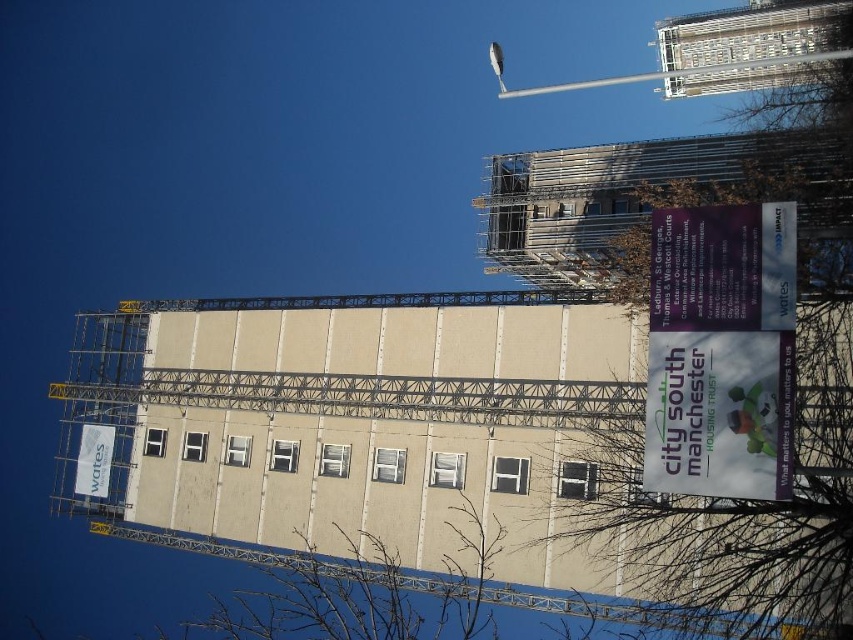
Is beige concrete building at upper right further to camera compared to white paper sign at upper left?

No.

Is beige concrete building at upper right above white paper sign at upper left?

Correct, beige concrete building at upper right is located above white paper sign at upper left.

Is point (793, 76) positioned behind point (80, 474)?

That is True.

You are a GUI agent. You are given a task and a screenshot of the screen. Output one action in this format:
    pyautogui.click(x=<x>, y=<y>)
    Task: Click on the beige concrete building at upper right
    The width and height of the screenshot is (853, 640).
    Given the screenshot: What is the action you would take?
    pyautogui.click(x=741, y=45)

Can you confirm if beige concrete building at upper right is bigger than metallic pole at upper center?

No, beige concrete building at upper right is not bigger than metallic pole at upper center.

Find the location of a particular element. This screenshot has height=640, width=853. beige concrete building at upper right is located at coordinates (741, 45).

Is point (677, 35) more distant than point (503, 97)?

Yes, it is.

This screenshot has height=640, width=853. I want to click on beige concrete building at upper right, so click(741, 45).

Is purple paper sign at upper right wider than metallic pole at upper center?

No.

Find the location of a particular element. This screenshot has width=853, height=640. purple paper sign at upper right is located at coordinates (721, 352).

Measure the distance between purple paper sign at upper right and camera.

A distance of 46.75 meters exists between purple paper sign at upper right and camera.

The image size is (853, 640). In order to click on purple paper sign at upper right in this screenshot , I will do `click(721, 352)`.